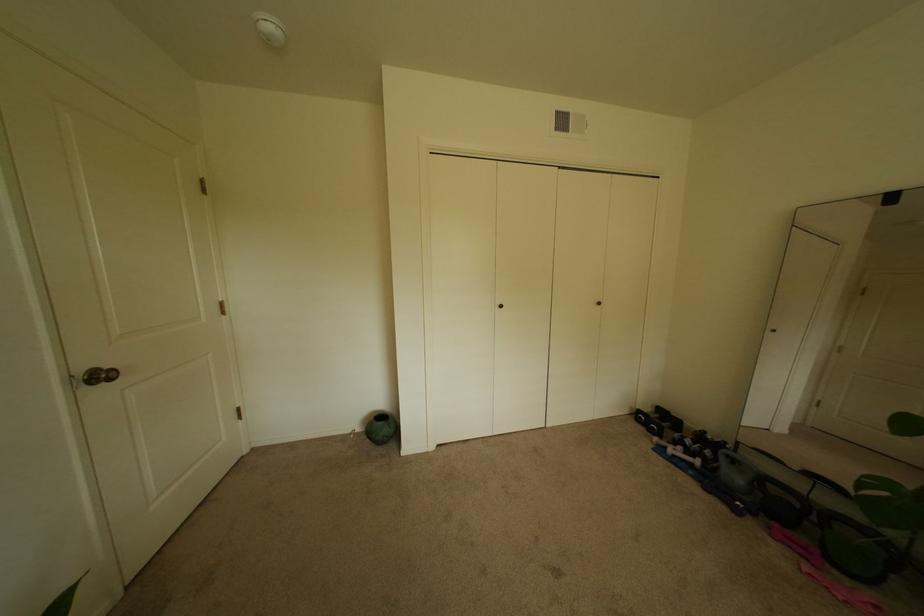
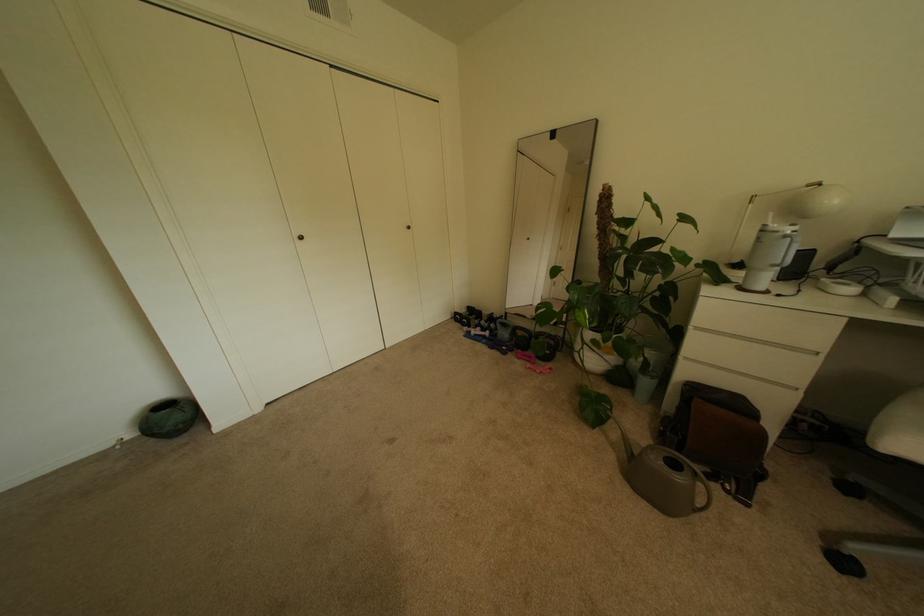
In the second image, find the point that corresponds to pixel 836 567 in the first image.

(545, 362)